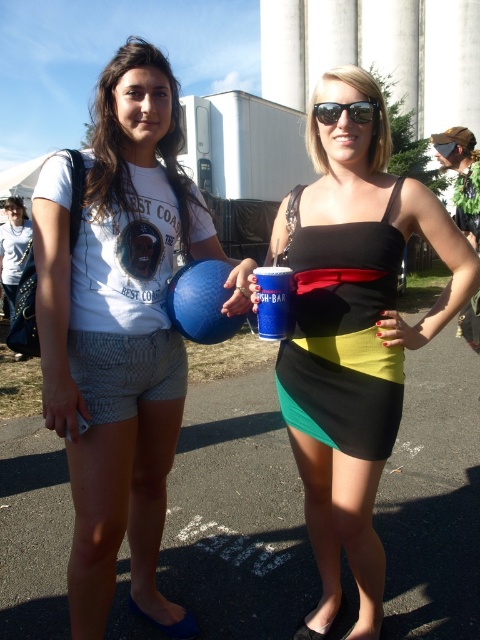
You are a photographer trying to capture the matte black dress at center in the image. Based on the coordinates provided in the description, where should you focus your camera to ensure the dress is centered in the frame?

The matte black dress at center is located at point coordinates of [352,333], so you should focus your camera at those coordinates to center the dress in the frame.

You are a photographer trying to capture a photo of the matte black dress at center and the blue rubber balloon at center. Which object should you focus on first if you want to ensure both are in frame and the larger one is emphasized?

The matte black dress at center is larger than the blue rubber balloon at center, so focus on the matte black dress at center first to ensure it is centered and emphasized in the frame.